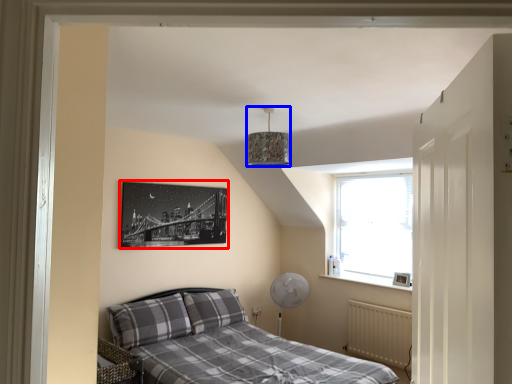
Question: Which object appears farthest to the camera in this image, picture frame (highlighted by a red box) or lamp (highlighted by a blue box)?

Choices:
 (A) picture frame
 (B) lamp

Answer: (A)